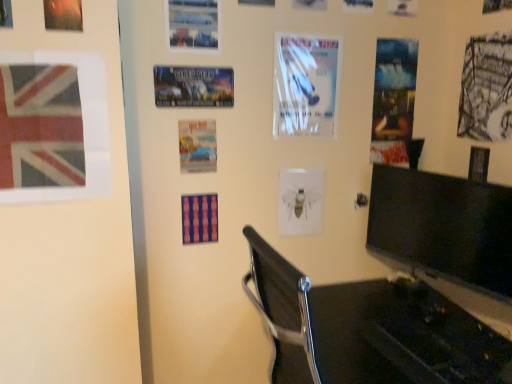
Question: In terms of height, does white glossy poster at upper center, which is the 2th poster page from back to front, look taller or shorter compared to white glossy poster at upper center, acting as the 2th poster starting from the top?

Choices:
 (A) tall
 (B) short

Answer: (B)

Question: Does point (402, 1) appear closer or farther from the camera than point (322, 76)?

Choices:
 (A) farther
 (B) closer

Answer: (A)

Question: Estimate the real-world distances between objects in this image. Which object is farther from the matte paper poster at center, the 2th poster positioned from the bottom?

Choices:
 (A) metallic poster at center, the third poster from the bottom
 (B) grayscale sketch at upper right, the 3th poster page when ordered from front to back
 (C) black plastic chair at lower center
 (D) white paper bee at center, which is the 5th poster in top-to-bottom order
 (E) metallic silver airplane at upper center, acting as the 5th poster page starting from the front

Answer: (B)

Question: Based on their relative distances, which object is nearer to the matte striped poster at center, which is counted as the third poster page, starting from the left?

Choices:
 (A) matte paper flag at left, which is counted as the first poster page, starting from the left
 (B) metallic silver poster at upper left, positioned as the 6th poster page in back-to-front order
 (C) metallic poster at center, which is counted as the third poster, starting from the top
 (D) white glossy poster at upper center, acting as the 2th poster starting from the top
 (E) matte blue poster at upper right, the 7th poster page viewed from the front

Answer: (C)